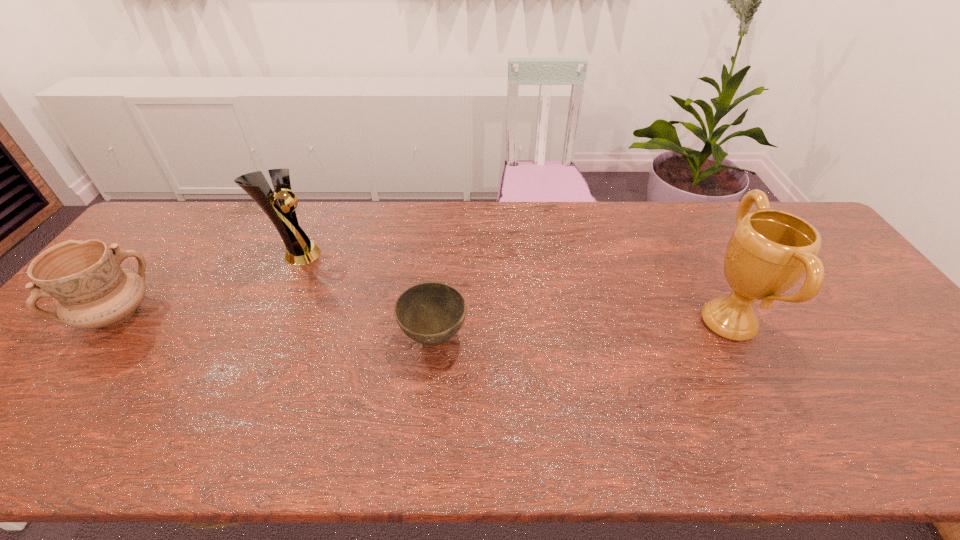
Locate an element on the screen. vacant space that satisfies the following two spatial constraints: 1. on the front side of the third tallest object; 2. on the right side of the third object from left to right is located at coordinates (98, 338).

Find the location of `free space that satisfies the following two spatial constraints: 1. at the front of the left award, where the globe is visible; 2. on the left side of the bowl`. free space that satisfies the following two spatial constraints: 1. at the front of the left award, where the globe is visible; 2. on the left side of the bowl is located at coordinates (257, 338).

Find the location of `free space in the image that satisfies the following two spatial constraints: 1. at the front of the third object from left to right, where the globe is visible; 2. on the left side of the second object from left to right`. free space in the image that satisfies the following two spatial constraints: 1. at the front of the third object from left to right, where the globe is visible; 2. on the left side of the second object from left to right is located at coordinates (257, 338).

Identify the location of free space that satisfies the following two spatial constraints: 1. at the front of the second object from right to left, where the globe is visible; 2. on the left side of the left award. (257, 338).

This screenshot has width=960, height=540. I want to click on free space that satisfies the following two spatial constraints: 1. on the front side of the pottery; 2. on the left side of the shortest object, so click(x=98, y=338).

You are a GUI agent. You are given a task and a screenshot of the screen. Output one action in this format:
    pyautogui.click(x=<x>, y=<y>)
    Task: Click on the vacant space that satisfies the following two spatial constraints: 1. at the front of the farther award, where the globe is visible; 2. on the back side of the second object from right to left
    
    Given the screenshot: What is the action you would take?
    pyautogui.click(x=257, y=338)

This screenshot has height=540, width=960. Identify the location of blank space that satisfies the following two spatial constraints: 1. at the front of the shortest object, where the globe is visible; 2. on the left side of the second object from left to right. (257, 338).